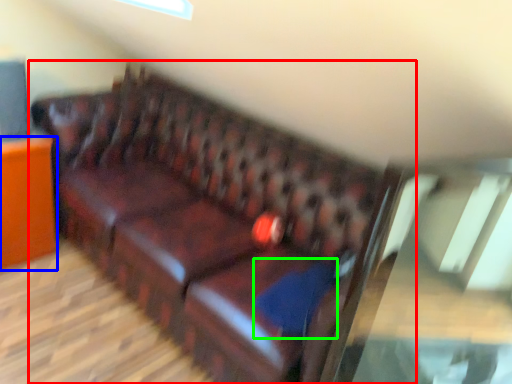
Question: Estimate the real-world distances between objects in this image. Which object is farther from studio couch (highlighted by a red box), furniture (highlighted by a blue box) or pillow (highlighted by a green box)?

Choices:
 (A) furniture
 (B) pillow

Answer: (A)